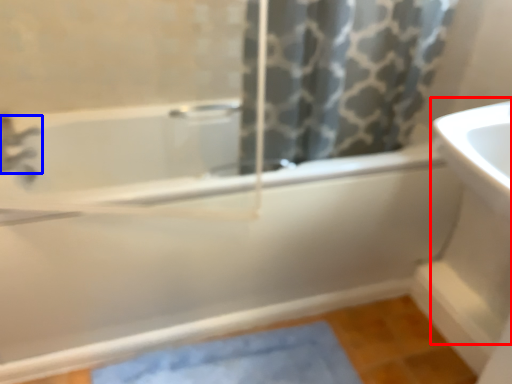
Question: Which of the following is the closest to the observer, sink (highlighted by a red box) or tap (highlighted by a blue box)?

Choices:
 (A) sink
 (B) tap

Answer: (A)